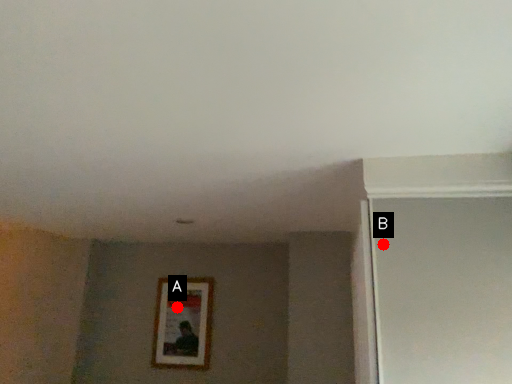
Question: Two points are circled on the image, labeled by A and B beside each circle. Which of the following is the farthest from the observer?

Choices:
 (A) A is further
 (B) B is further

Answer: (A)